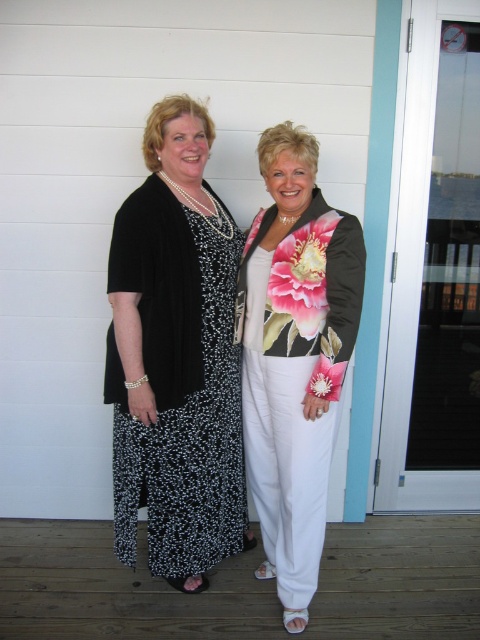
Question: From the image, what is the correct spatial relationship of black dotted dress at left in relation to floral satin jacket at center?

Choices:
 (A) above
 (B) below

Answer: (B)

Question: Estimate the real-world distances between objects in this image. Which object is closer to the floral satin jacket at center?

Choices:
 (A) white wood porch at lower center
 (B) black dotted dress at left

Answer: (B)

Question: Which object is positioned farthest from the white wood porch at lower center?

Choices:
 (A) black dotted dress at left
 (B) floral satin jacket at center

Answer: (B)

Question: From the image, what is the correct spatial relationship of white wood porch at lower center in relation to black dotted dress at left?

Choices:
 (A) left
 (B) right

Answer: (B)

Question: Observing the image, what is the correct spatial positioning of white wood porch at lower center in reference to floral satin jacket at center?

Choices:
 (A) above
 (B) below

Answer: (B)

Question: Which object appears closest to the camera in this image?

Choices:
 (A) black dotted dress at left
 (B) floral satin jacket at center

Answer: (B)